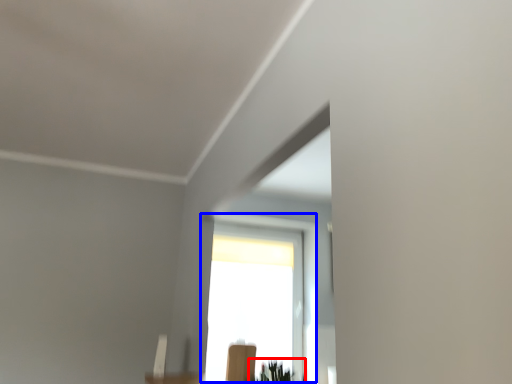
Question: Which object is closer to the camera taking this photo, plant (highlighted by a red box) or window (highlighted by a blue box)?

Choices:
 (A) plant
 (B) window

Answer: (A)